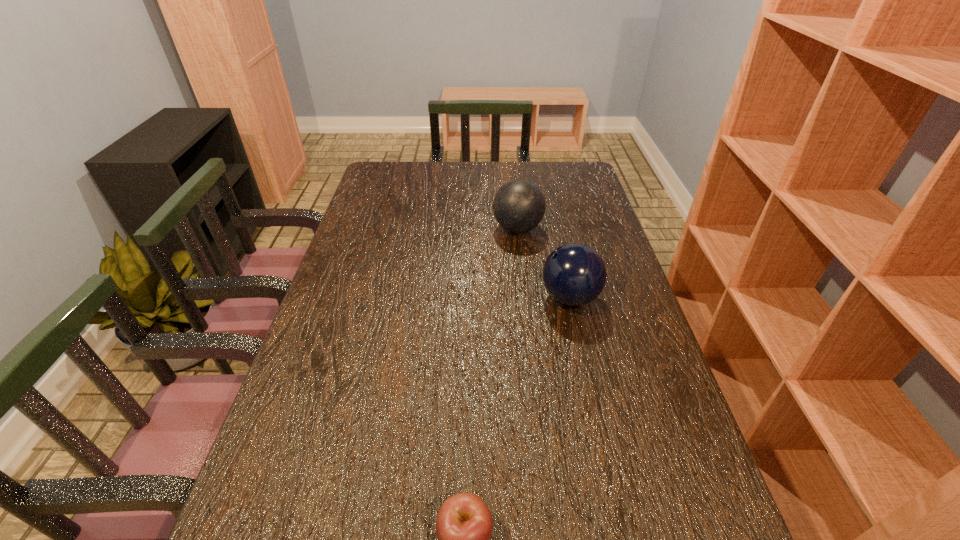
The height and width of the screenshot is (540, 960). What are the coordinates of `vacant space at the left edge of the desktop` in the screenshot? It's located at (270, 496).

Where is `vacant space at the right edge of the desktop`? vacant space at the right edge of the desktop is located at coordinates (572, 222).

Where is `free spot at the far right corner of the desktop`? Image resolution: width=960 pixels, height=540 pixels. free spot at the far right corner of the desktop is located at coordinates (559, 174).

I want to click on vacant space in between the farthest object and the nearer bowling ball, so click(x=543, y=263).

At what (x,y) coordinates should I click in order to perform the action: click on free space that is in between the farthest object and the nearer bowling ball. Please return your answer as a coordinate pair (x, y). This screenshot has height=540, width=960. Looking at the image, I should click on (543, 263).

Find the location of a particular element. free area in between the farther bowling ball and the second nearest object is located at coordinates (543, 263).

Where is `free space that is in between the nearer bowling ball and the farther bowling ball`? The image size is (960, 540). free space that is in between the nearer bowling ball and the farther bowling ball is located at coordinates (543, 263).

At what (x,y) coordinates should I click in order to perform the action: click on blank region between the nearer bowling ball and the farthest object. Please return your answer as a coordinate pair (x, y). The width and height of the screenshot is (960, 540). Looking at the image, I should click on (543, 263).

Select which object appears as the second closest to the nearest object. Please provide its 2D coordinates. Your answer should be formatted as a tuple, i.e. [(x, y)], where the tuple contains the x and y coordinates of a point satisfying the conditions above.

[(519, 205)]

Find the location of `the second closest object to the farthest object`. the second closest object to the farthest object is located at coordinates (464, 524).